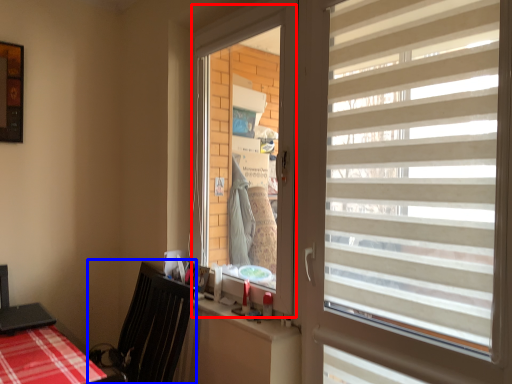
Question: Among these objects, which one is nearest to the camera, window screen (highlighted by a red box) or swivel chair (highlighted by a blue box)?

Choices:
 (A) window screen
 (B) swivel chair

Answer: (B)